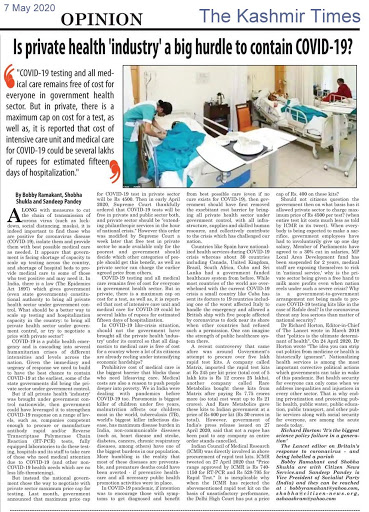
Identify the location of hospital bed. This screenshot has width=369, height=512. (329, 126).